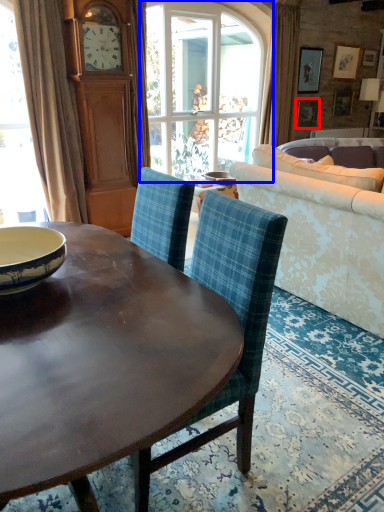
Question: Which of the following is the closest to the observer, picture frame (highlighted by a red box) or window (highlighted by a blue box)?

Choices:
 (A) picture frame
 (B) window

Answer: (B)